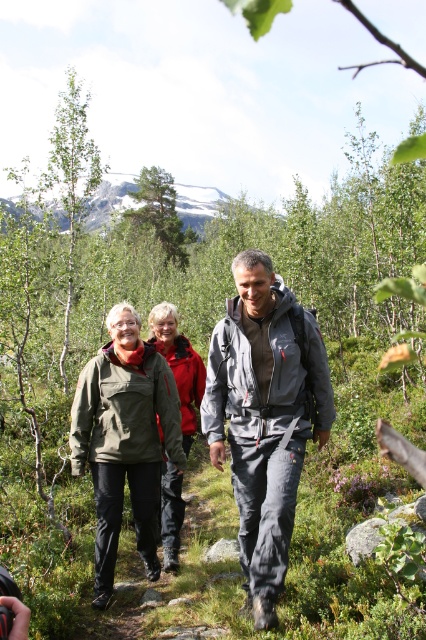
Can you confirm if gray fabric jacket at center is shorter than olive-green fabric jacket at center?

No.

Can you confirm if gray fabric jacket at center is bigger than olive-green fabric jacket at center?

No, gray fabric jacket at center is not bigger than olive-green fabric jacket at center.

Is point (236, 480) in front of point (94, 602)?

That is True.

Where is `gray fabric jacket at center`? gray fabric jacket at center is located at coordinates (264, 417).